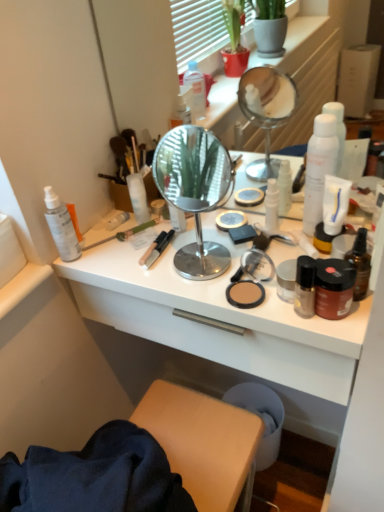
Locate an element on the screen. This screenshot has height=512, width=384. free space to the left of white matte bottle at center, the 5th toiletry viewed from the right is located at coordinates (102, 229).